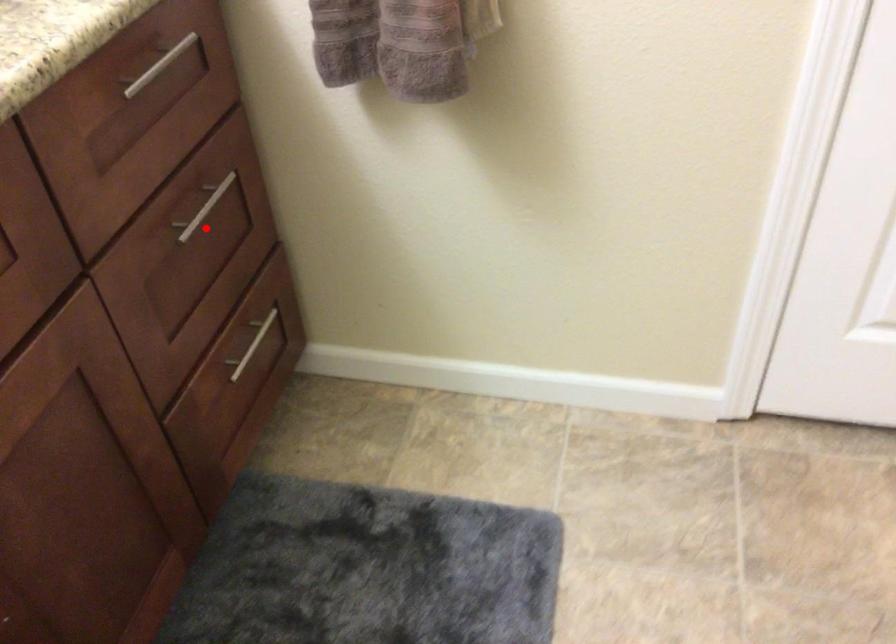
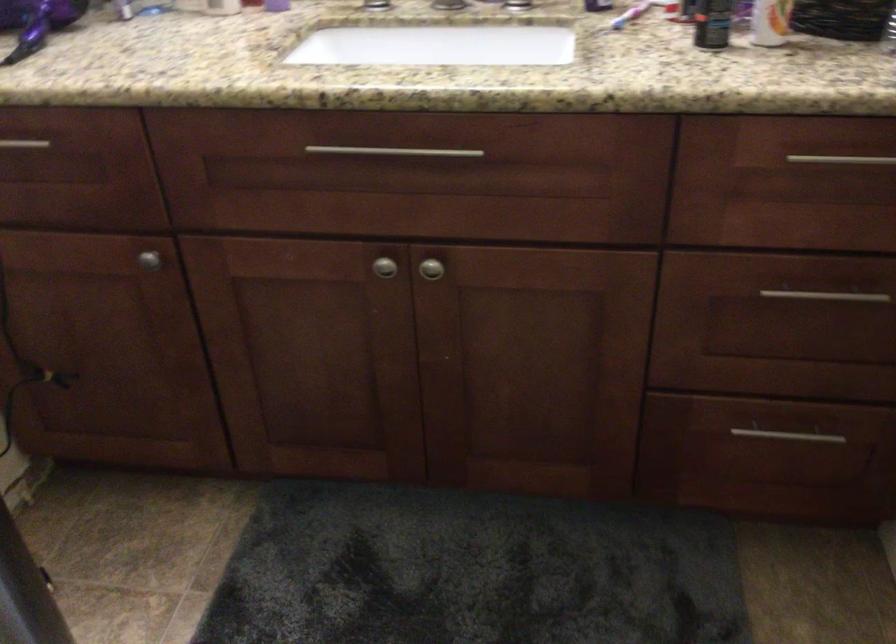
Question: I am providing you with two images of the same scene from different viewpoints. A red point is marked on the first image. Is the red point's position out of view in image 2?

Choices:
 (A) Yes
 (B) No

Answer: (B)